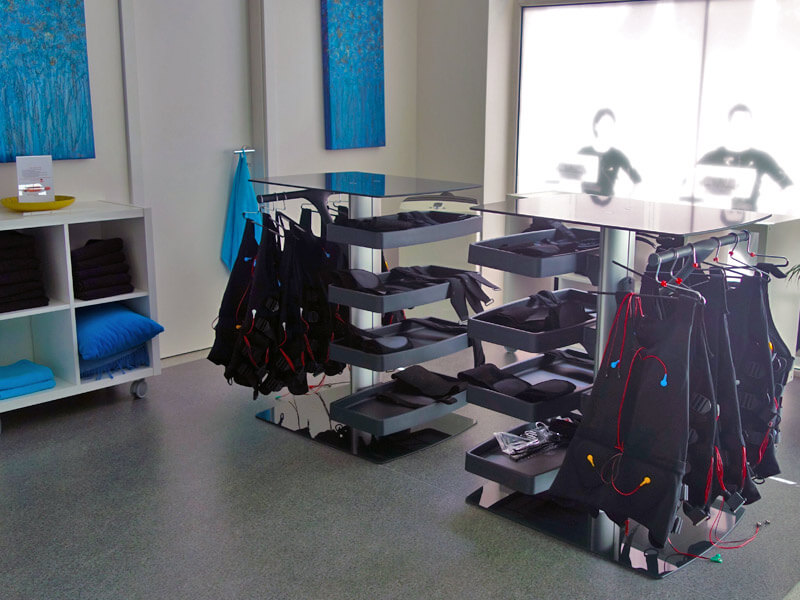
Where is `floor`? The width and height of the screenshot is (800, 600). floor is located at coordinates (224, 530).